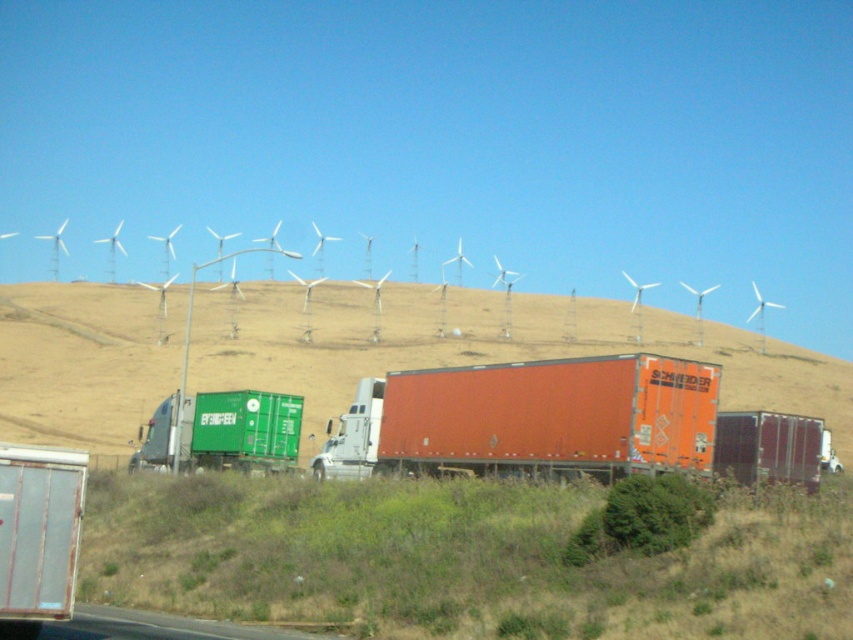
Based on the photo, you are a delivery driver who needs to drive your truck up the hill. You see the brown grassy hillside at center and the asphalt road at lower center. Which path should you choose to reach the top of the hill?

You should choose the asphalt road at lower center because the brown grassy hillside at center is further away from the viewer, meaning the asphalt road is closer and more accessible for driving up the hill.

You are a drone operator trying to capture the brown grassy hillside at center from the air. According to the image coordinates, where exactly should you position your drone to get the best shot?

The brown grassy hillside at center is located at coordinates point (480,346), so the drone should be positioned there to capture it best.